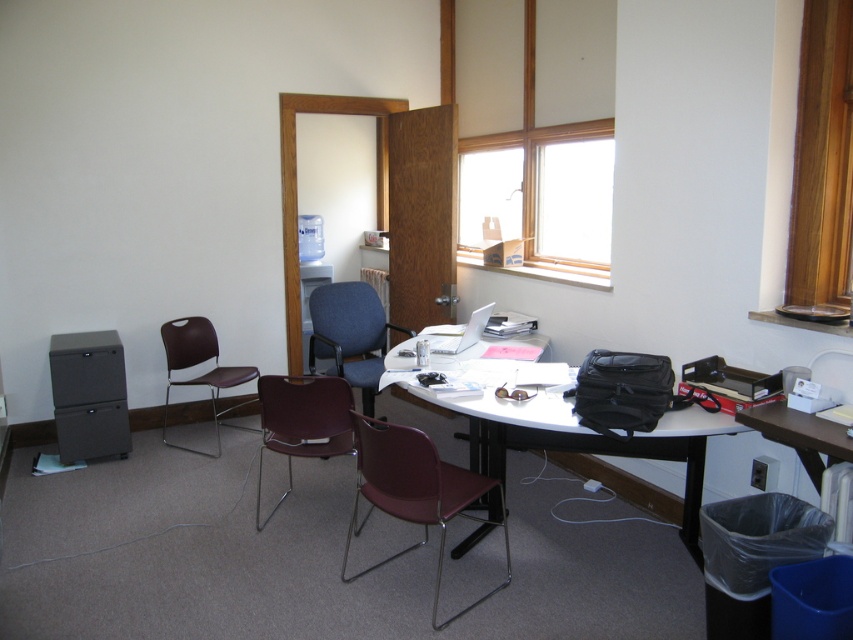
Which is below, wooden frame at upper center or matte black table at center?

matte black table at center

Which is in front, point (492, 193) or point (548, 420)?

Point (548, 420)

Where is `wooden frame at upper center`? wooden frame at upper center is located at coordinates (537, 131).

Between matte black table at center and blue fabric chair at center, which one is positioned higher?

blue fabric chair at center

Is point (689, 442) positioned before point (323, 372)?

Yes, point (689, 442) is in front of point (323, 372).

Where is `matte black table at center`? Image resolution: width=853 pixels, height=640 pixels. matte black table at center is located at coordinates tap(581, 440).

What are the coordinates of `maroon plastic chair at center` in the screenshot? It's located at (415, 492).

Which of these two, maroon plastic chair at center or blue fabric chair at center, stands shorter?

Standing shorter between the two is maroon plastic chair at center.

Image resolution: width=853 pixels, height=640 pixels. What do you see at coordinates (415, 492) in the screenshot?
I see `maroon plastic chair at center` at bounding box center [415, 492].

Find the location of a particular element. The height and width of the screenshot is (640, 853). maroon plastic chair at center is located at coordinates (415, 492).